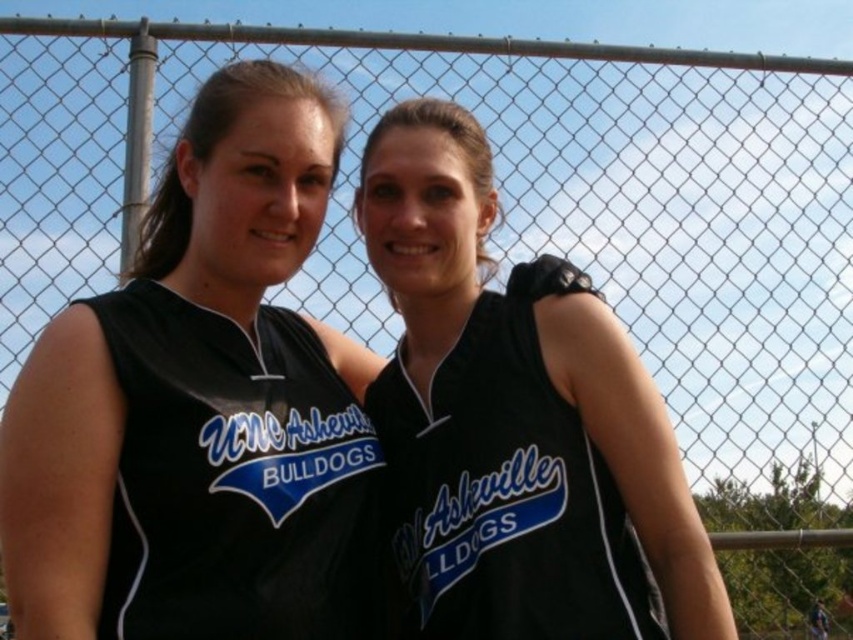
Question: Is black jersey at left in front of black jersey at center?

Choices:
 (A) yes
 (B) no

Answer: (A)

Question: Which object is farther from the camera taking this photo?

Choices:
 (A) black jersey at center
 (B) black jersey at left

Answer: (A)

Question: Does black jersey at left appear on the right side of black jersey at center?

Choices:
 (A) yes
 (B) no

Answer: (B)

Question: Does black jersey at left appear under black jersey at center?

Choices:
 (A) yes
 (B) no

Answer: (B)

Question: Which object is closer to the camera taking this photo?

Choices:
 (A) black jersey at left
 (B) black jersey at center

Answer: (A)